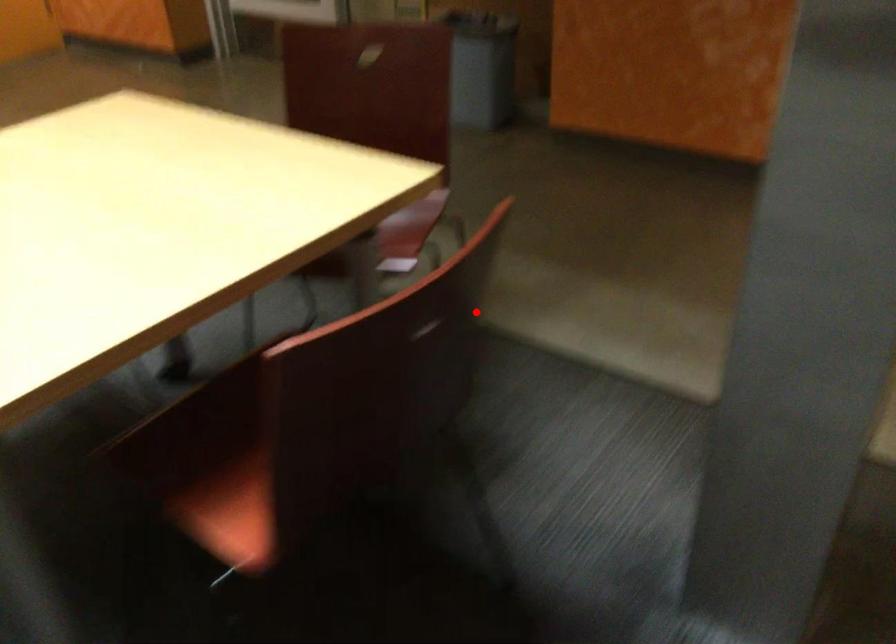
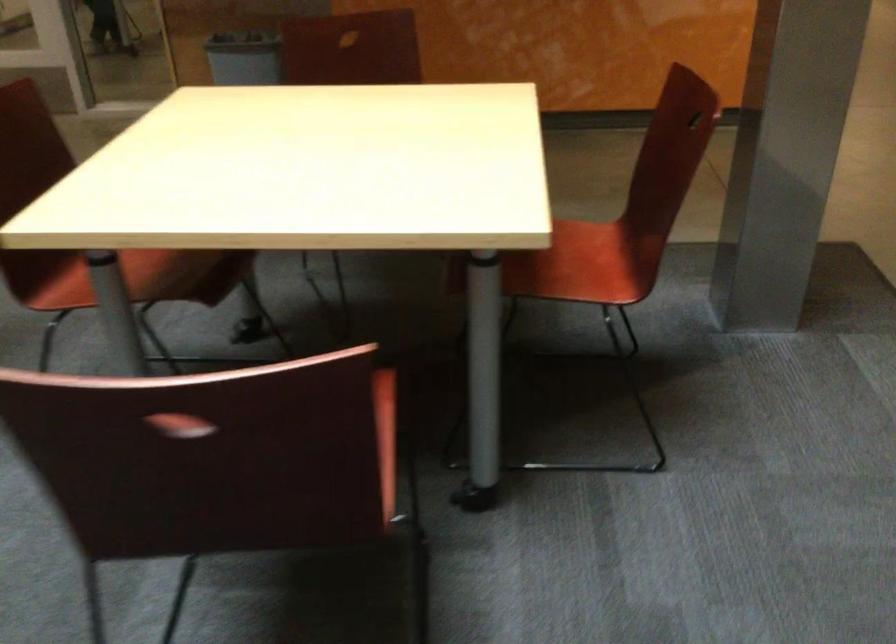
Question: I am providing you with two images of the same scene from different viewpoints. Given a red point in image1, look at the same physical point in image2. Is it:

Choices:
 (A) Closer to the viewpoint
 (B) Farther from the viewpoint

Answer: (B)